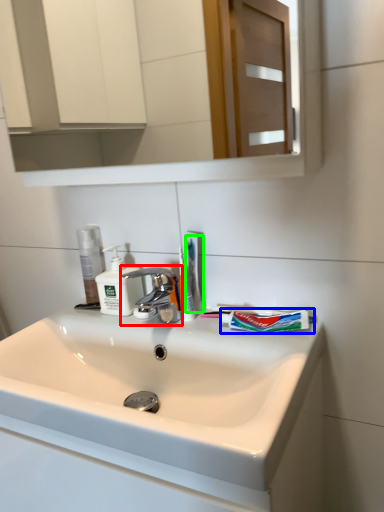
Question: Based on their relative distances, which object is farther from tap (highlighted by a red box)? Choose from toothpaste (highlighted by a blue box) and toothbrush (highlighted by a green box).

Choices:
 (A) toothpaste
 (B) toothbrush

Answer: (A)